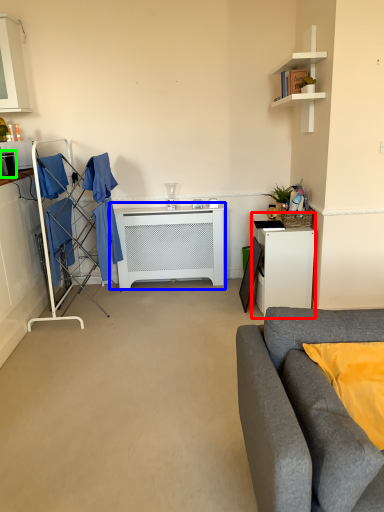
Question: Estimate the real-world distances between objects in this image. Which object is closer to desk (highlighted by a red box), table (highlighted by a blue box) or appliance (highlighted by a green box)?

Choices:
 (A) table
 (B) appliance

Answer: (A)